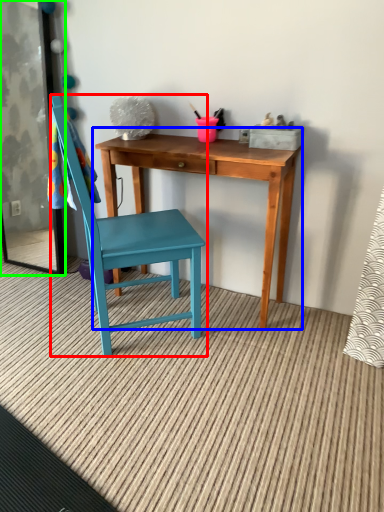
Question: Estimate the real-world distances between objects in this image. Which object is closer to chair (highlighted by a red box), table (highlighted by a blue box) or screen door (highlighted by a green box)?

Choices:
 (A) table
 (B) screen door

Answer: (A)